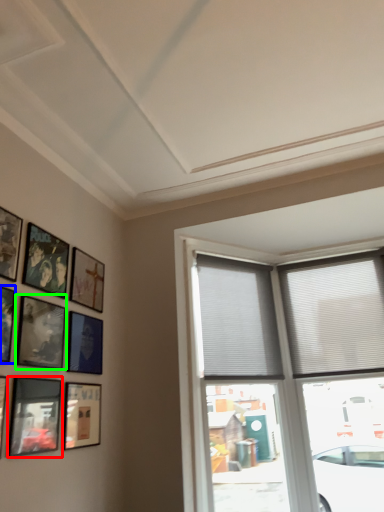
Question: Which is farther away from picture frame (highlighted by a red box)? picture frame (highlighted by a blue box) or picture frame (highlighted by a green box)?

Choices:
 (A) picture frame
 (B) picture frame

Answer: (A)